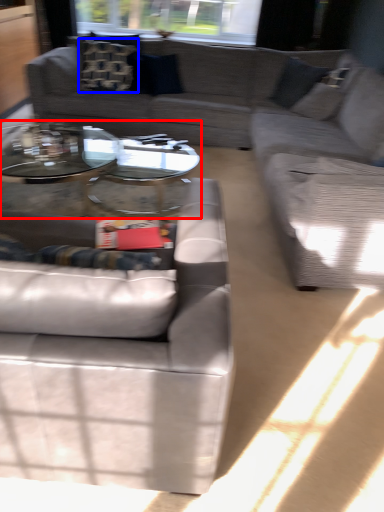
Question: Which point is closer to the camera, coffee table (highlighted by a red box) or pillow (highlighted by a blue box)?

Choices:
 (A) coffee table
 (B) pillow

Answer: (A)